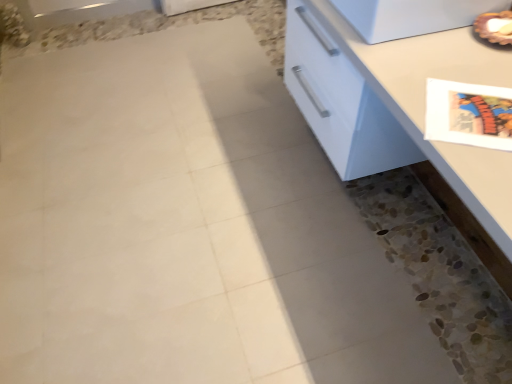
Question: Is white glossy countertop at right at the right side of white glossy refrigerator at upper right?

Choices:
 (A) yes
 (B) no

Answer: (A)

Question: Can you confirm if white glossy countertop at right is wider than white glossy refrigerator at upper right?

Choices:
 (A) yes
 (B) no

Answer: (A)

Question: From the image's perspective, is white glossy countertop at right on white glossy refrigerator at upper right?

Choices:
 (A) no
 (B) yes

Answer: (A)

Question: Are white glossy countertop at right and white glossy refrigerator at upper right located far from each other?

Choices:
 (A) yes
 (B) no

Answer: (B)

Question: Is white glossy countertop at right outside white glossy refrigerator at upper right?

Choices:
 (A) yes
 (B) no

Answer: (A)

Question: Does white glossy countertop at right have a greater height compared to white glossy refrigerator at upper right?

Choices:
 (A) no
 (B) yes

Answer: (B)

Question: Considering the relative sizes of white glossy refrigerator at upper right and white glossy countertop at right in the image provided, is white glossy refrigerator at upper right smaller than white glossy countertop at right?

Choices:
 (A) no
 (B) yes

Answer: (B)

Question: Is white glossy refrigerator at upper right not near white glossy countertop at right?

Choices:
 (A) no
 (B) yes

Answer: (A)

Question: Is white glossy refrigerator at upper right shorter than white glossy countertop at right?

Choices:
 (A) no
 (B) yes

Answer: (B)

Question: Is white glossy refrigerator at upper right at the left side of white glossy countertop at right?

Choices:
 (A) no
 (B) yes

Answer: (B)

Question: Is white glossy countertop at right inside white glossy refrigerator at upper right?

Choices:
 (A) yes
 (B) no

Answer: (B)

Question: Is white glossy refrigerator at upper right positioned behind white glossy countertop at right?

Choices:
 (A) yes
 (B) no

Answer: (A)

Question: From the image's perspective, is white glossy countertop at right positioned above or below white glossy refrigerator at upper right?

Choices:
 (A) above
 (B) below

Answer: (B)